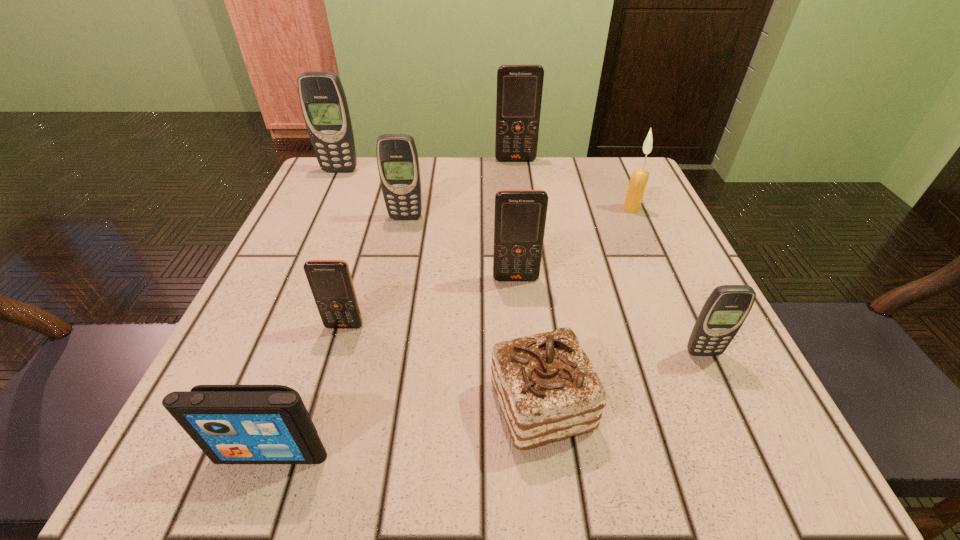
Locate which orange cellular telephone is the closest to the rightmost cellular telephone. Please provide its 2D coordinates. Your answer should be formatted as a tuple, i.e. [(x, y)], where the tuple contains the x and y coordinates of a point satisfying the conditions above.

[(520, 215)]

Where is `orange cellular telephone that can be found as the closest to the second farthest object`? orange cellular telephone that can be found as the closest to the second farthest object is located at coordinates (519, 86).

Locate an element on the screen. gray cellular telephone that stands as the second closest to the iPod is located at coordinates (727, 307).

Locate an element on the screen. The width and height of the screenshot is (960, 540). the second closest gray cellular telephone to the rightmost gray cellular telephone is located at coordinates (323, 101).

This screenshot has width=960, height=540. Identify the location of vacant space that satisfies the following two spatial constraints: 1. on the screen of the chocolate cake; 2. on the right side of the smallest orange cellular telephone. coord(321,406).